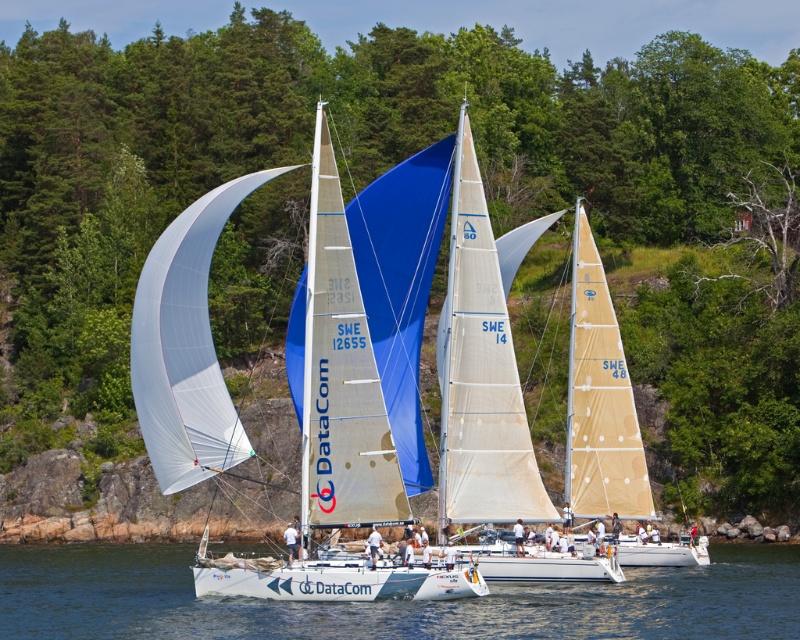
Question: Among these points, which one is farthest from the camera?

Choices:
 (A) (158, 449)
 (B) (80, 586)

Answer: (B)

Question: Is white matte sailboat at center above transparent water at center?

Choices:
 (A) yes
 (B) no

Answer: (A)

Question: Can you confirm if white matte sailboat at center is positioned above transparent water at center?

Choices:
 (A) no
 (B) yes

Answer: (B)

Question: Can you confirm if white matte sailboat at center is positioned to the left of transparent water at center?

Choices:
 (A) no
 (B) yes

Answer: (B)

Question: Which of the following is the closest to the observer?

Choices:
 (A) transparent water at center
 (B) white matte sailboat at center

Answer: (A)

Question: Among these objects, which one is nearest to the camera?

Choices:
 (A) transparent water at center
 (B) white matte sailboat at center

Answer: (A)